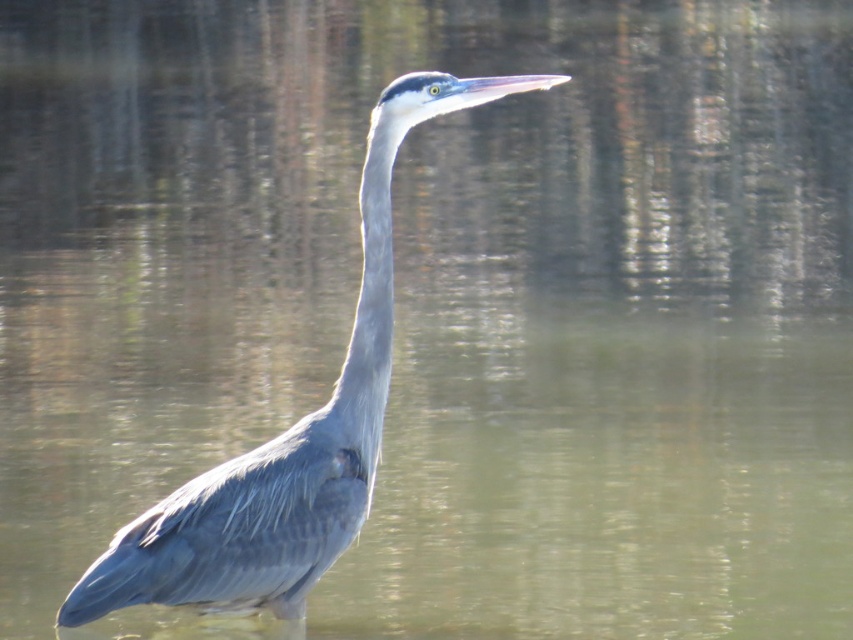
Does gray matte bird at center appear under gray matte neck at center?

Correct, gray matte bird at center is located below gray matte neck at center.

Does gray matte bird at center appear on the left side of gray matte neck at center?

Indeed, gray matte bird at center is positioned on the left side of gray matte neck at center.

Who is more distant from viewer, (190,598) or (337,406)?

The point (337,406) is more distant.

The width and height of the screenshot is (853, 640). What are the coordinates of `gray matte bird at center` in the screenshot? It's located at tap(289, 435).